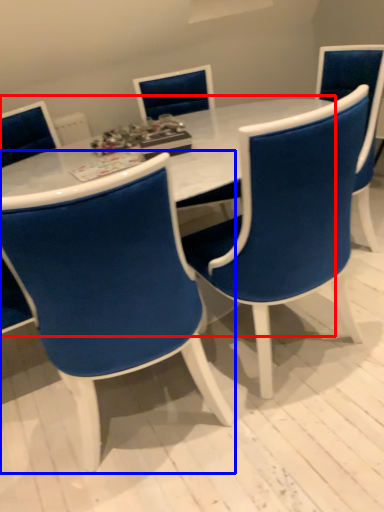
Question: Which object appears farthest to the camera in this image, table (highlighted by a red box) or chair (highlighted by a blue box)?

Choices:
 (A) table
 (B) chair

Answer: (A)